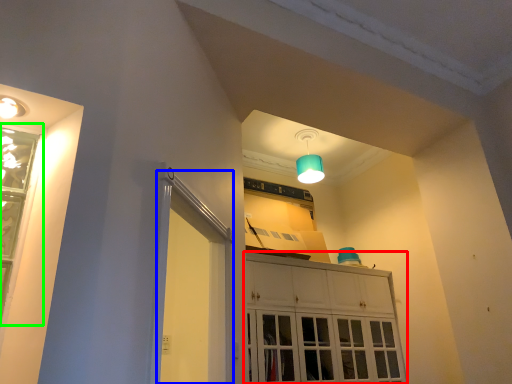
Question: Based on their relative distances, which object is nearer to cabinetry (highlighted by a red box)? Choose from screen door (highlighted by a blue box) and window (highlighted by a green box).

Choices:
 (A) screen door
 (B) window

Answer: (A)